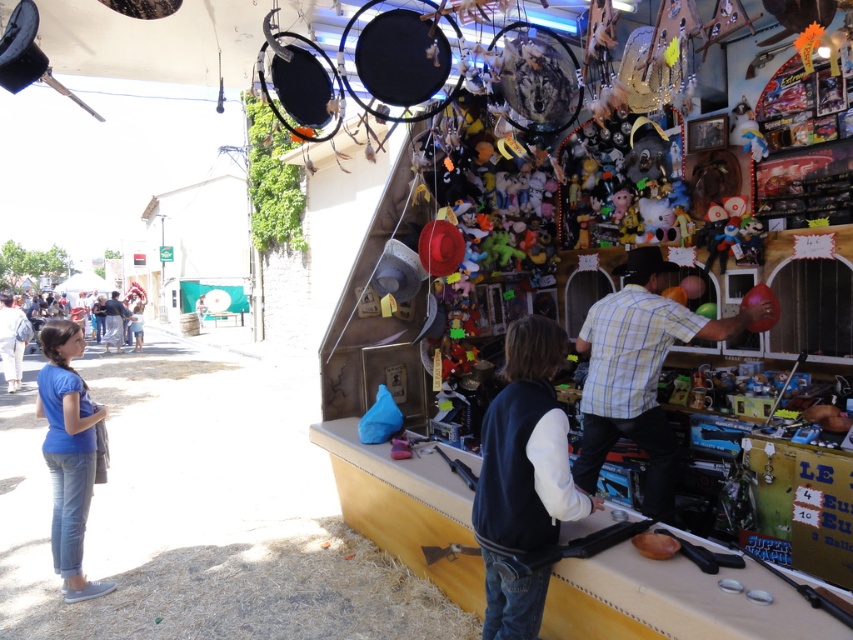
Is blue cotton shirt at left wider than light blue denim jeans at left?

No, blue cotton shirt at left is not wider than light blue denim jeans at left.

Between point (88, 458) and point (120, 348), which one is positioned in front?

Point (88, 458)

Between point (100, 406) and point (125, 316), which one is positioned behind?

Point (125, 316)

This screenshot has height=640, width=853. I want to click on blue cotton shirt at left, so click(x=68, y=452).

Does yellow plaid shirt at center appear under light blue denim jeans at left?

Yes.

This screenshot has width=853, height=640. What do you see at coordinates (637, 372) in the screenshot? I see `yellow plaid shirt at center` at bounding box center [637, 372].

Image resolution: width=853 pixels, height=640 pixels. Find the location of `yellow plaid shirt at center`. yellow plaid shirt at center is located at coordinates (637, 372).

Does point (618, 346) come in front of point (71, 600)?

Yes, point (618, 346) is in front of point (71, 600).

Is point (674, 273) in front of point (68, 588)?

That is False.

You are a GUI agent. You are given a task and a screenshot of the screen. Output one action in this format:
    pyautogui.click(x=<x>, y=<y>)
    Task: Click on the yellow plaid shirt at center
    The height and width of the screenshot is (640, 853).
    Given the screenshot: What is the action you would take?
    pyautogui.click(x=637, y=372)